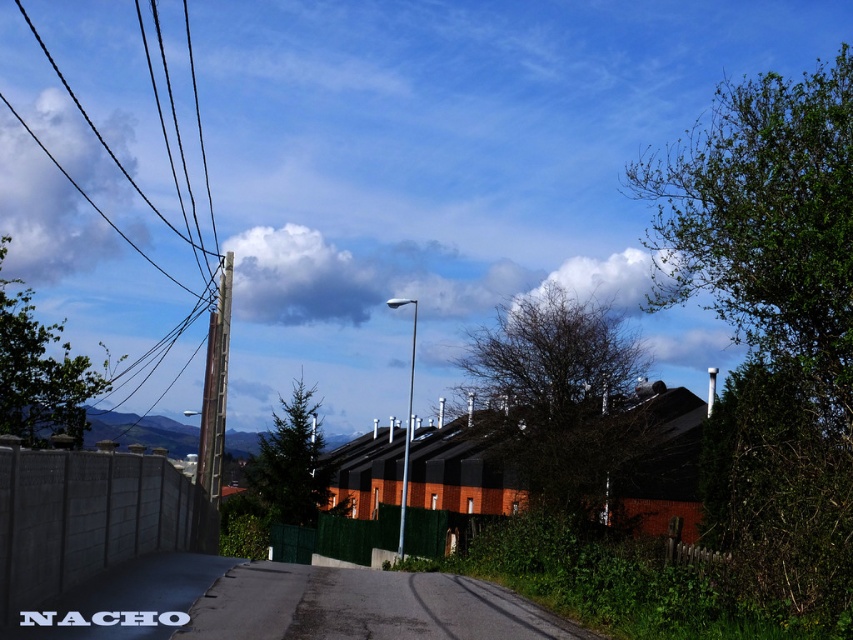
You are a delivery driver approaching the intersection ahead. You see the asphalt road at center and the concrete fence at lower left. Which object is positioned to the right side of the other?

The asphalt road at center is to the right of the concrete fence at lower left.

Consider the image. You are driving a delivery van that is 8 feet wide. You need to navigate through the space between the asphalt road at center and the concrete fence at lower left. Can your van fit through this space?

The distance between the asphalt road at center and the concrete fence at lower left is 9.13 feet. Since the van is 8 feet wide, it can fit through the space as the width is sufficient.